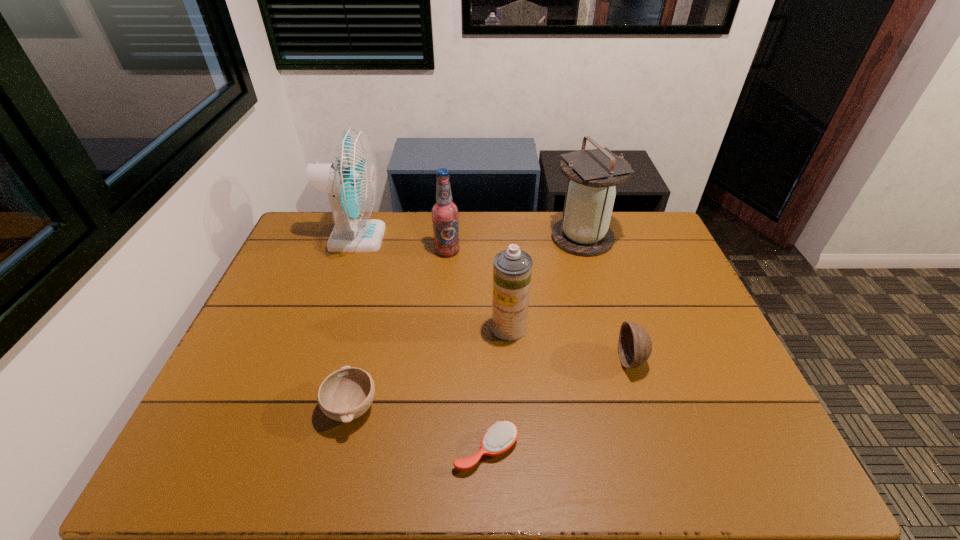
You are a GUI agent. You are given a task and a screenshot of the screen. Output one action in this format:
    pyautogui.click(x=<x>, y=<y>)
    Task: Click on the fan
    
    Given the screenshot: What is the action you would take?
    pyautogui.click(x=351, y=180)

What are the coordinates of `lantern` in the screenshot? It's located at (584, 230).

Image resolution: width=960 pixels, height=540 pixels. Identify the location of alcohol. (444, 212).

I want to click on aerosol can, so click(x=512, y=268).

In order to click on the third shortest object in this screenshot , I will do `click(634, 346)`.

Locate an element on the screen. The width and height of the screenshot is (960, 540). the farther bowl is located at coordinates (634, 346).

Locate an element on the screen. This screenshot has height=540, width=960. the sixth tallest object is located at coordinates (346, 394).

What are the coordinates of `the nearer bowl` in the screenshot? It's located at (346, 394).

Locate an element on the screen. The height and width of the screenshot is (540, 960). the shortest object is located at coordinates (499, 438).

Find the location of `free spot located in front of the fan to face the airflow`. free spot located in front of the fan to face the airflow is located at coordinates (472, 238).